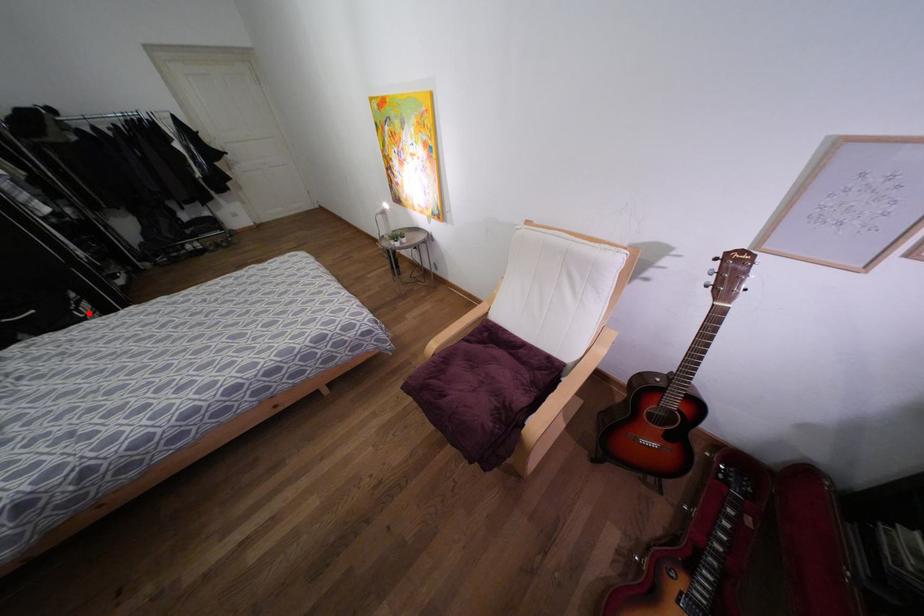
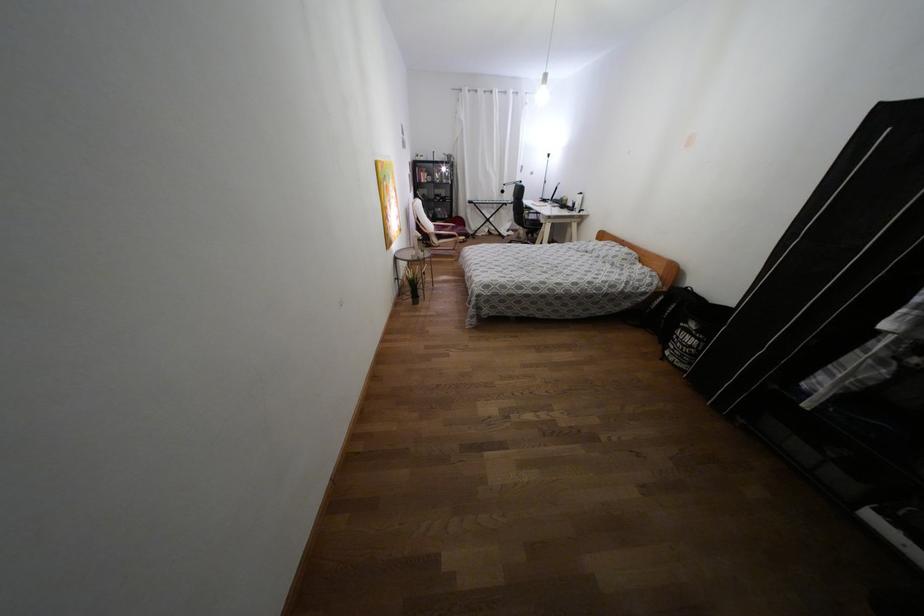
Question: I am providing you with two images of the same scene from different viewpoints. Image1 has a red point marked. In image2, the corresponding 3D location appears at what relative position? Reply with the corresponding letter.

Choices:
 (A) Closer
 (B) Farther

Answer: (A)